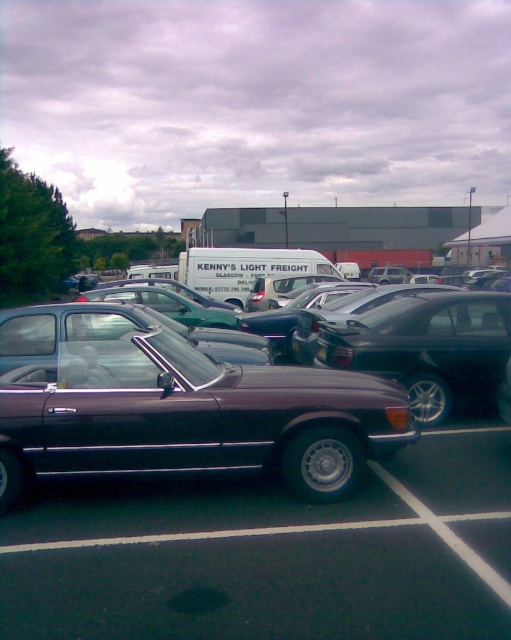
You are a delivery driver who needs to park your truck between the shiny maroon convertible at center and the shiny dark brown convertible at center. Which direction should you drive to park between them?

The shiny maroon convertible at center is below the shiny dark brown convertible at center, so you should drive upwards to park between them.

Consider the image. You are standing in the parking lot and want to take a photo of the shiny maroon convertible at center. If your camera can focus on objects up to 10 feet away, will you need to move closer or farther away to capture a clear photo?

The shiny maroon convertible at center is 10.90 feet from viewer. Since the camera can focus up to 10 feet, you need to move closer to ensure the convertible is within the camera range.

You are standing in the parking lot and want to take a photo of both the maroon classic convertible car and the white van with Kenny Light Freight. You need to position yourself so that both points, point (449, 493) and point (296, 444), are in your camera frame. Since one point is closer to the camera than the other, which point should you focus on to ensure both are in focus?

You should focus on point (296, 444) because it is closer to the camera than point (449, 493). By focusing on the closer point, the depth of field will likely include the farther point as well, ensuring both are in focus.